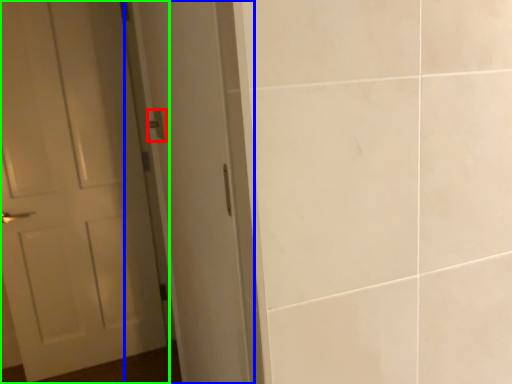
Question: Which is farther away from door handle (highlighted by a red box)? screen door (highlighted by a blue box) or door (highlighted by a green box)?

Choices:
 (A) screen door
 (B) door

Answer: (B)